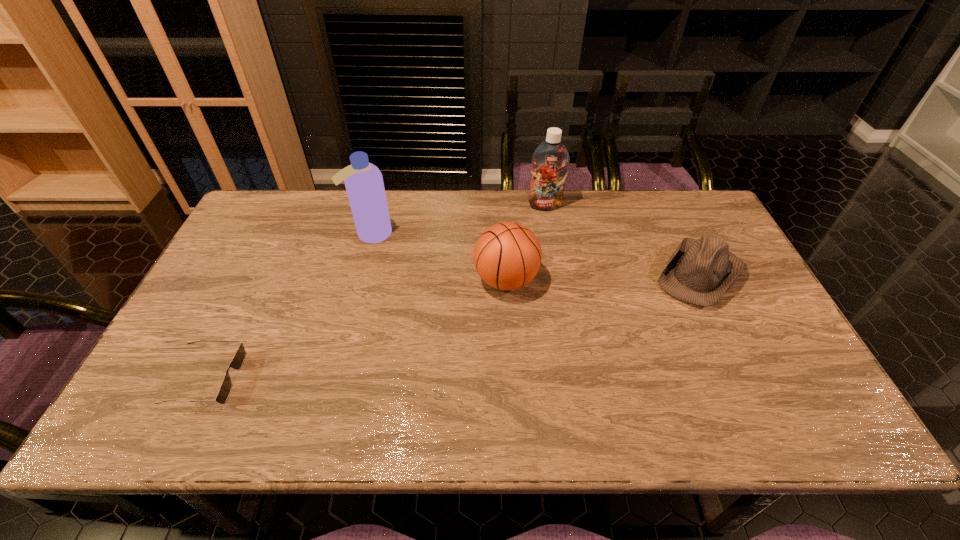
Locate an element on the screen. This screenshot has height=540, width=960. vacant area between the left shampoo and the farther shampoo is located at coordinates (458, 220).

Locate which object ranks in proximity to the fedora. Please provide its 2D coordinates. Your answer should be formatted as a tuple, i.e. [(x, y)], where the tuple contains the x and y coordinates of a point satisfying the conditions above.

[(550, 160)]

The image size is (960, 540). What are the coordinates of `object that stands as the third closest to the nearer shampoo` in the screenshot? It's located at (550, 160).

At what (x,y) coordinates should I click in order to perform the action: click on vacant region that satisfies the following two spatial constraints: 1. on the front side of the fedora; 2. on the front-facing side of the nearest object. Please return your answer as a coordinate pair (x, y). Looking at the image, I should click on (751, 379).

Where is `vacant region that satisfies the following two spatial constraints: 1. on the front side of the nearer shampoo; 2. on the right side of the rightmost object`? The width and height of the screenshot is (960, 540). vacant region that satisfies the following two spatial constraints: 1. on the front side of the nearer shampoo; 2. on the right side of the rightmost object is located at coordinates (361, 274).

In order to click on vacant point that satisfies the following two spatial constraints: 1. on the front label of the farthest object; 2. on the front-facing side of the shortest object in this screenshot , I will do `click(574, 379)`.